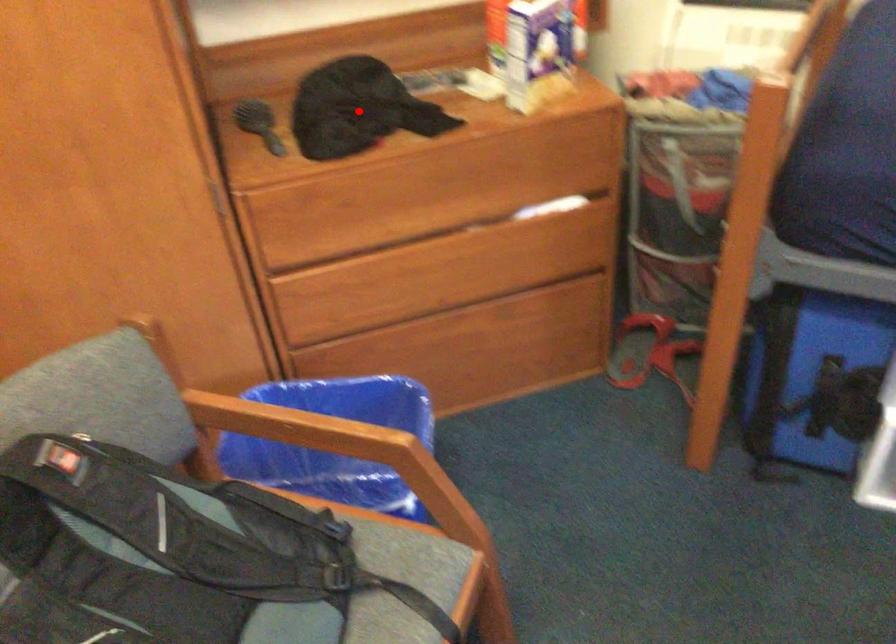
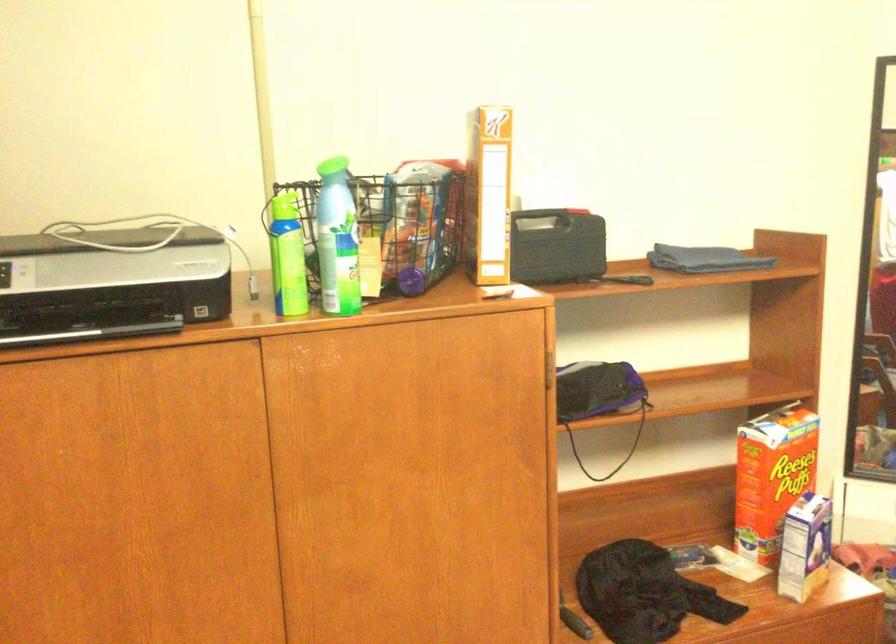
In the second image, find the point that corresponds to the highlighted location in the first image.

(643, 592)